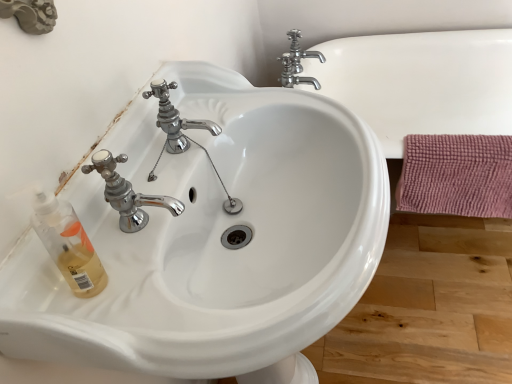
Question: From the image's perspective, does chrome metallic faucet at upper center, marked as the first tap in a top-to-bottom arrangement, appear higher than pink textured bath towel at right?

Choices:
 (A) yes
 (B) no

Answer: (A)

Question: Does chrome metallic faucet at upper center, which ranks as the second tap in front-to-back order, have a lesser height compared to pink textured bath towel at right?

Choices:
 (A) yes
 (B) no

Answer: (A)

Question: Is chrome metallic faucet at upper center, which ranks as the second tap in front-to-back order, smaller than pink textured bath towel at right?

Choices:
 (A) no
 (B) yes

Answer: (B)

Question: From a real-world perspective, is chrome metallic faucet at upper center, the second tap from the bottom, physically below pink textured bath towel at right?

Choices:
 (A) no
 (B) yes

Answer: (A)

Question: Is pink textured bath towel at right inside chrome metallic faucet at upper center, marked as the first tap in a top-to-bottom arrangement?

Choices:
 (A) yes
 (B) no

Answer: (B)

Question: Is chrome metallic faucet at upper center, positioned as the second tap in left-to-right order, wider than pink textured bath towel at right?

Choices:
 (A) yes
 (B) no

Answer: (A)

Question: Is polished chrome faucet at upper center, which is the first tap in left-to-right order, a part of chrome metallic faucet at upper center, which ranks as the second tap in front-to-back order?

Choices:
 (A) no
 (B) yes

Answer: (A)

Question: Is chrome metallic faucet at upper center, the second tap from the bottom, behind polished chrome faucet at upper center, which is the 1th tap in front-to-back order?

Choices:
 (A) no
 (B) yes

Answer: (B)

Question: Can you confirm if chrome metallic faucet at upper center, the first tap from the back, is thinner than polished chrome faucet at upper center, marked as the first tap in a bottom-to-top arrangement?

Choices:
 (A) yes
 (B) no

Answer: (B)

Question: Could you tell me if chrome metallic faucet at upper center, the first tap from the back, is turned towards polished chrome faucet at upper center, which is the 1th tap in front-to-back order?

Choices:
 (A) yes
 (B) no

Answer: (B)

Question: Does chrome metallic faucet at upper center, which ranks as the first tap in right-to-left order, come in front of polished chrome faucet at upper center, which is the 1th tap in front-to-back order?

Choices:
 (A) no
 (B) yes

Answer: (A)

Question: Is chrome metallic faucet at upper center, which ranks as the second tap in front-to-back order, facing away from polished chrome faucet at upper center, which is the 2th tap in right-to-left order?

Choices:
 (A) yes
 (B) no

Answer: (B)

Question: Does polished chrome faucet at upper center, marked as the first tap in a bottom-to-top arrangement, have a lesser width compared to pink textured bath towel at right?

Choices:
 (A) yes
 (B) no

Answer: (B)